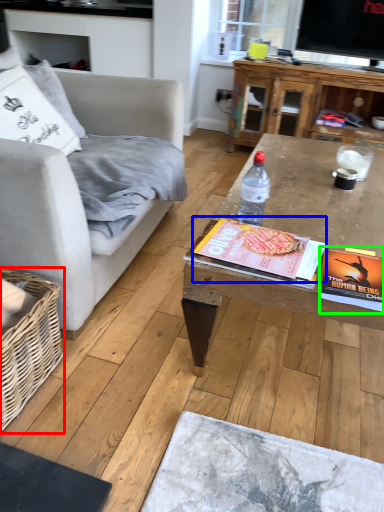
Question: Estimate the real-world distances between objects in this image. Which object is closer to basket (highlighted by a red box), magazine (highlighted by a blue box) or paperback book (highlighted by a green box)?

Choices:
 (A) magazine
 (B) paperback book

Answer: (A)